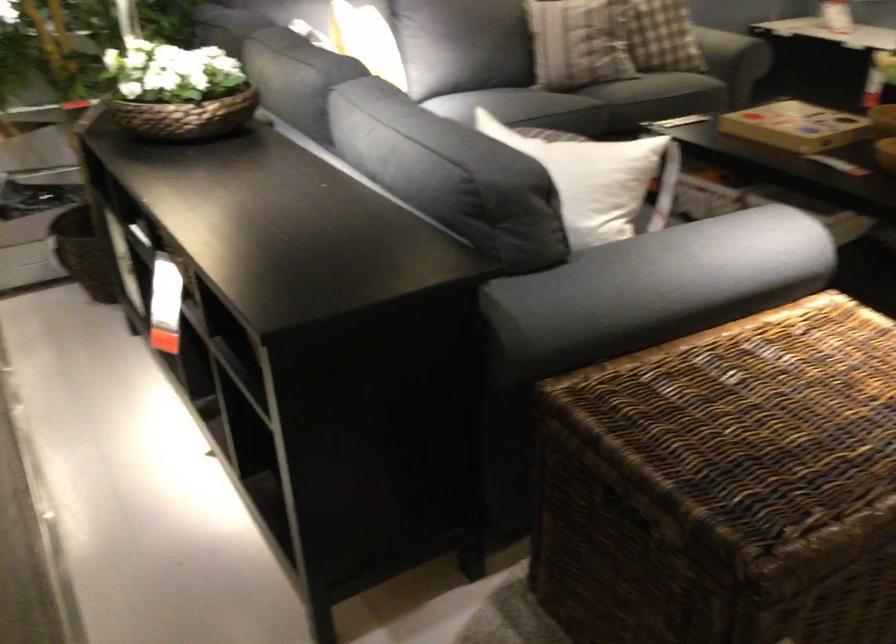
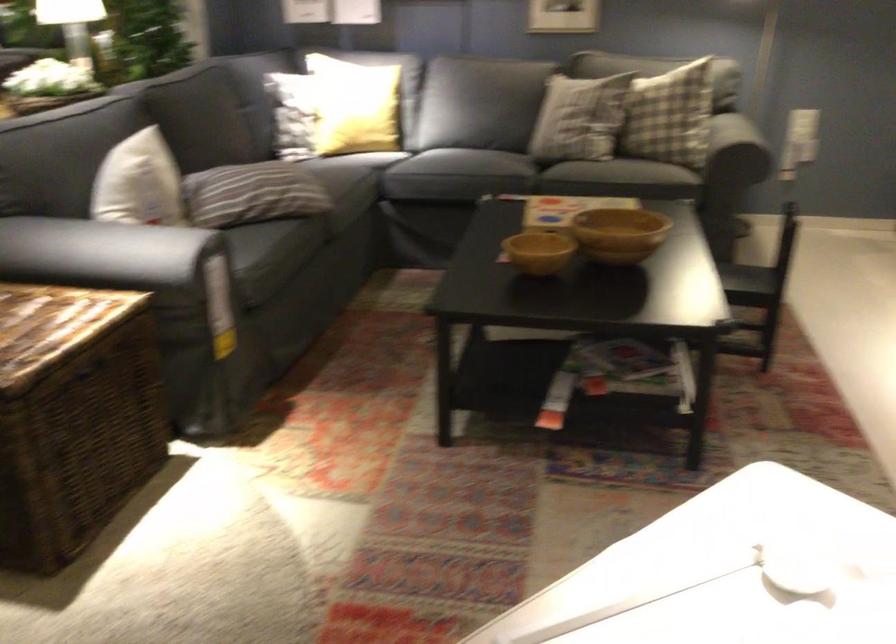
Locate, in the second image, the point that corresponds to point 607,162 in the first image.

(139, 183)